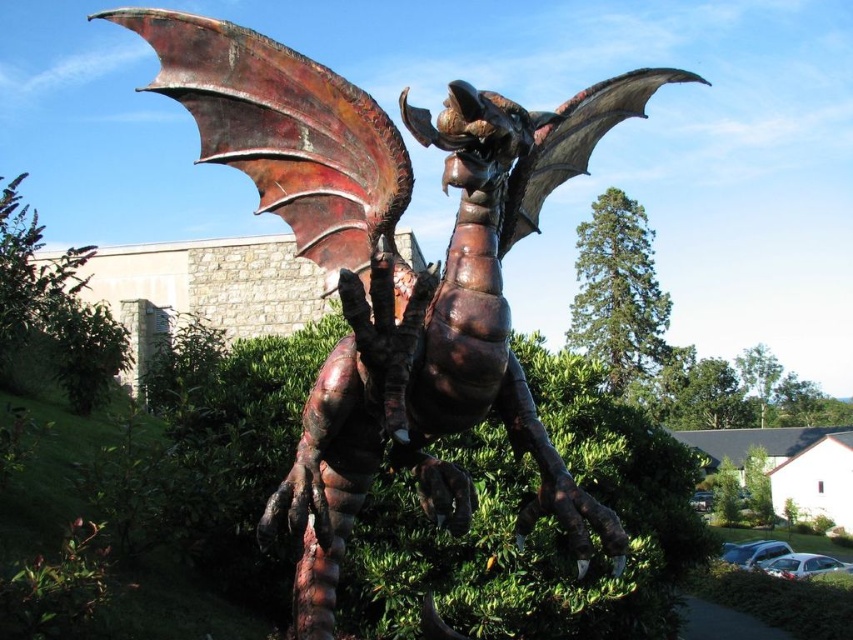
Is point (447, 148) less distant than point (587, 104)?

Yes, point (447, 148) is closer to viewer.

Between point (339, 152) and point (657, 83), which one is positioned behind?

Positioned behind is point (657, 83).

Does point (393, 188) lie behind point (637, 115)?

No, (393, 188) is closer to viewer.

The height and width of the screenshot is (640, 853). Find the location of `rusty metal dragon at center`. rusty metal dragon at center is located at coordinates (393, 273).

Which is in front, point (178, 36) or point (651, 284)?

Point (178, 36)

Between rusty metal wing at upper left and green leafy bush at upper center, which one has more height?

With more height is green leafy bush at upper center.

Which is in front, point (149, 44) or point (659, 349)?

Point (149, 44) is in front.

I want to click on rusty metal wing at upper left, so click(x=286, y=134).

Between point (646, 444) and point (556, 184), which one is positioned behind?

The point (646, 444) is behind.

Between green leafy hedge at center and rusty metal wing at upper center, which one has less height?

Standing shorter between the two is rusty metal wing at upper center.

Locate an element on the screen. green leafy hedge at center is located at coordinates coord(532,529).

The image size is (853, 640). In order to click on green leafy hedge at center in this screenshot , I will do [532, 529].